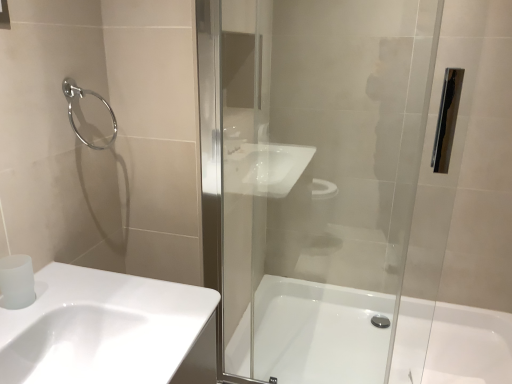
Question: Is white glossy sink at lower left taller than satin white toilet paper at lower left?

Choices:
 (A) yes
 (B) no

Answer: (A)

Question: Is white glossy sink at lower left facing away from satin white toilet paper at lower left?

Choices:
 (A) no
 (B) yes

Answer: (A)

Question: From a real-world perspective, is white glossy sink at lower left below satin white toilet paper at lower left?

Choices:
 (A) yes
 (B) no

Answer: (A)

Question: Does white glossy sink at lower left appear on the right side of satin white toilet paper at lower left?

Choices:
 (A) yes
 (B) no

Answer: (A)

Question: Could you tell me if white glossy sink at lower left is turned towards satin white toilet paper at lower left?

Choices:
 (A) yes
 (B) no

Answer: (B)

Question: Is white glossy sink at lower left positioned far away from satin white toilet paper at lower left?

Choices:
 (A) yes
 (B) no

Answer: (B)

Question: Is white glossy sink at lower left turned away from chrome metallic towel ring at upper left?

Choices:
 (A) no
 (B) yes

Answer: (A)

Question: Is white glossy sink at lower left positioned before chrome metallic towel ring at upper left?

Choices:
 (A) yes
 (B) no

Answer: (A)

Question: Is white glossy sink at lower left further to the viewer compared to chrome metallic towel ring at upper left?

Choices:
 (A) no
 (B) yes

Answer: (A)

Question: Is white glossy sink at lower left outside of chrome metallic towel ring at upper left?

Choices:
 (A) yes
 (B) no

Answer: (A)

Question: Is white glossy sink at lower left shorter than chrome metallic towel ring at upper left?

Choices:
 (A) yes
 (B) no

Answer: (A)

Question: Is chrome metallic towel ring at upper left located within white glossy sink at lower left?

Choices:
 (A) yes
 (B) no

Answer: (B)

Question: Is white glossy bathtub at center at the left side of satin white toilet paper at lower left?

Choices:
 (A) yes
 (B) no

Answer: (B)